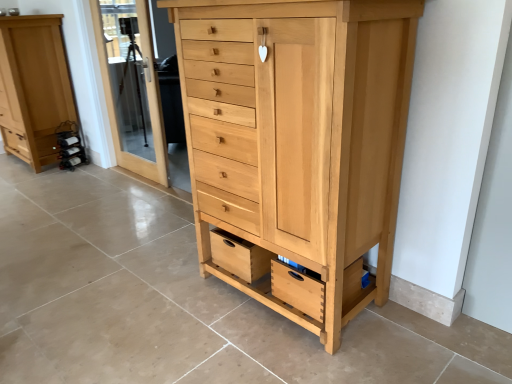
Question: Is transparent glass door at upper left at the back of natural wood drawer at lower center?

Choices:
 (A) no
 (B) yes

Answer: (A)

Question: Is natural wood drawer at lower center at the right side of transparent glass door at upper left?

Choices:
 (A) no
 (B) yes

Answer: (B)

Question: Considering the relative positions of natural wood drawer at lower center and transparent glass door at upper left in the image provided, is natural wood drawer at lower center to the left of transparent glass door at upper left from the viewer's perspective?

Choices:
 (A) yes
 (B) no

Answer: (B)

Question: Is transparent glass door at upper left inside natural wood drawer at lower center?

Choices:
 (A) no
 (B) yes

Answer: (A)

Question: From the image's perspective, is natural wood drawer at lower center below transparent glass door at upper left?

Choices:
 (A) no
 (B) yes

Answer: (B)

Question: Can you confirm if natural wood drawer at lower center is smaller than transparent glass door at upper left?

Choices:
 (A) yes
 (B) no

Answer: (A)

Question: From a real-world perspective, is transparent glass door at upper left positioned over natural wood chest of drawers at center, acting as the second chest of drawers starting from the back, based on gravity?

Choices:
 (A) no
 (B) yes

Answer: (B)

Question: Is transparent glass door at upper left bigger than natural wood chest of drawers at center, marked as the first chest of drawers in a right-to-left arrangement?

Choices:
 (A) no
 (B) yes

Answer: (A)

Question: Does transparent glass door at upper left appear on the left side of natural wood chest of drawers at center, acting as the second chest of drawers starting from the back?

Choices:
 (A) no
 (B) yes

Answer: (B)

Question: Would you consider transparent glass door at upper left to be distant from natural wood chest of drawers at center, which is the first chest of drawers in front-to-back order?

Choices:
 (A) no
 (B) yes

Answer: (B)

Question: From the image's perspective, does transparent glass door at upper left appear higher than natural wood chest of drawers at center, which is the first chest of drawers in front-to-back order?

Choices:
 (A) no
 (B) yes

Answer: (B)

Question: Is transparent glass door at upper left smaller than natural wood chest of drawers at center, which is the first chest of drawers in front-to-back order?

Choices:
 (A) yes
 (B) no

Answer: (A)

Question: From the image's perspective, is transparent glass door at upper left located beneath natural wood drawer at lower center?

Choices:
 (A) no
 (B) yes

Answer: (A)